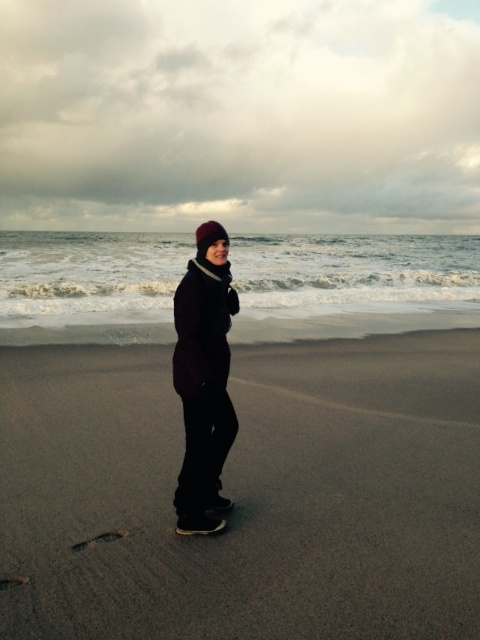
You are a photographer planning to take a portrait of the person in the scene. You want to ensure the matte dark brown coat at center is visible against the dark sand at center. Based on the scene description, what aspect of the coat and sand could help you achieve this?

The matte dark brown coat at center is taller than the dark sand at center, so positioning the person so that the coat stands above the sand level will help make the coat visible against the dark sand at center.

You are a drone operator tasked with capturing aerial footage of the beach scene. You need to ensure that the camera focuses on the dark sand at center. Given that the coordinate system starts at the bottom left corner of the image, with x increasing to the right and y increasing upward, can you confirm if the point at coordinates point (244, 493) is located at the center of the image?

The point (244, 493) is marked as dark sand at center, so yes, the coordinates are correctly placed at the center of the image.